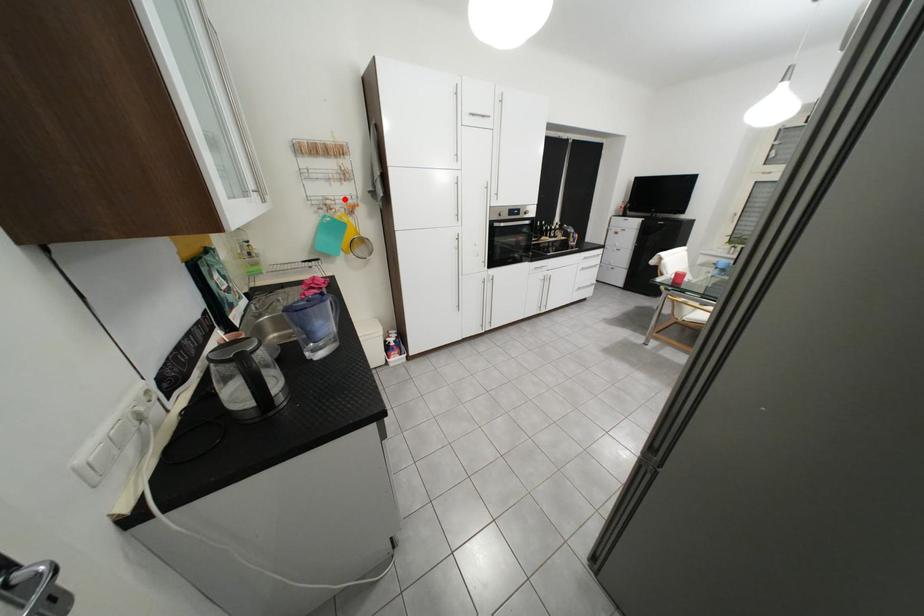
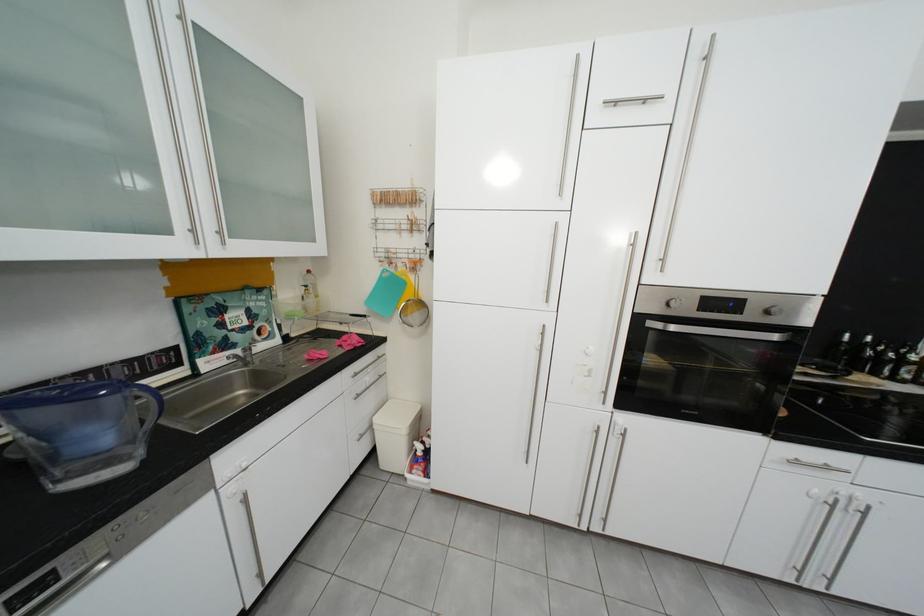
Find the pixel in the second image that matches the highlighted location in the first image.

(406, 252)